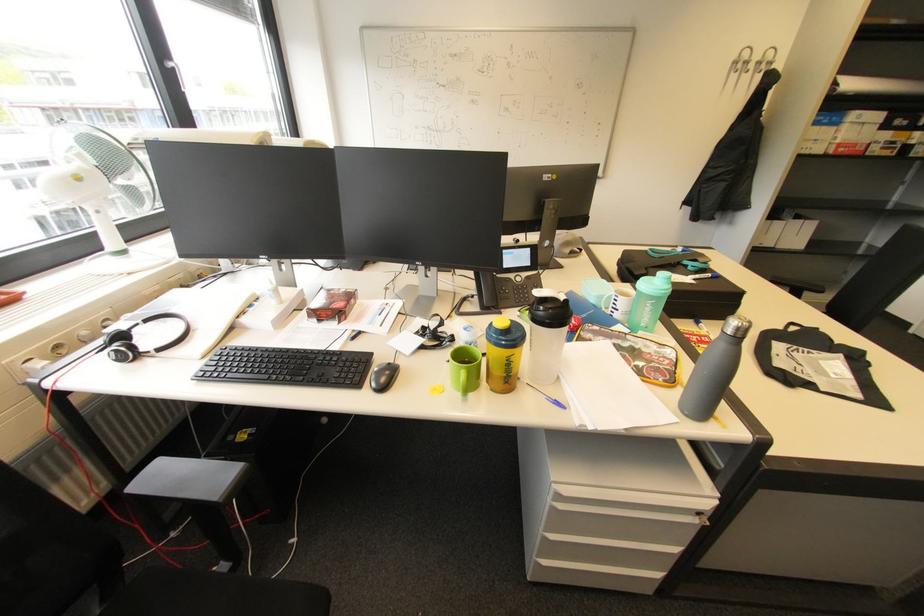
Image resolution: width=924 pixels, height=616 pixels. Identify the location of black chair sitting surface. (188, 479).